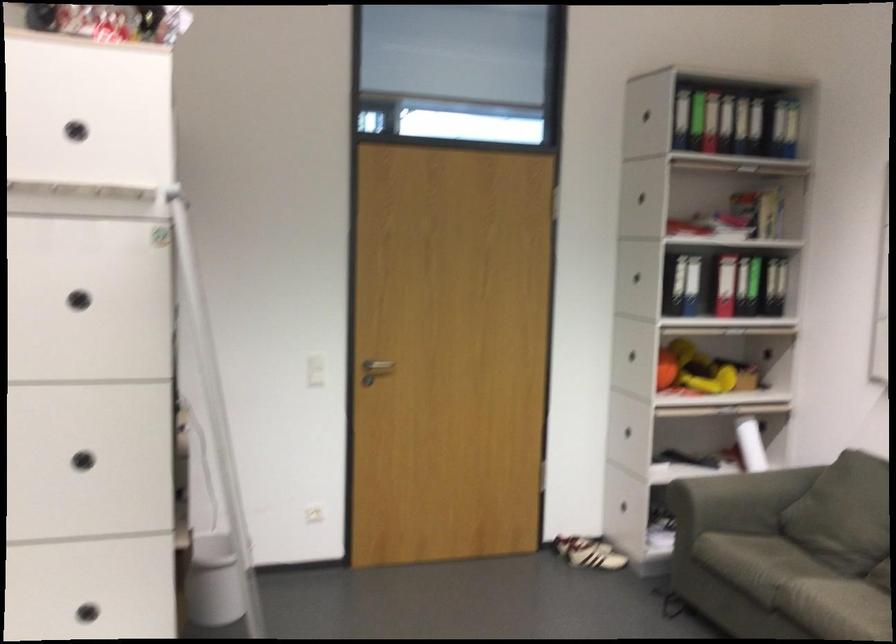
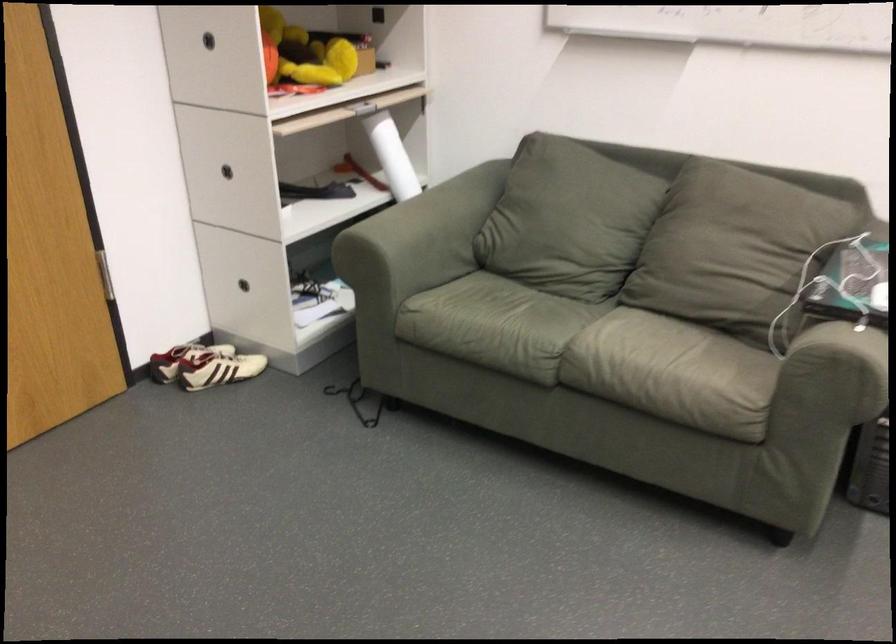
The point at (x=716, y=496) is marked in the first image. Where is the corresponding point in the second image?

(416, 242)